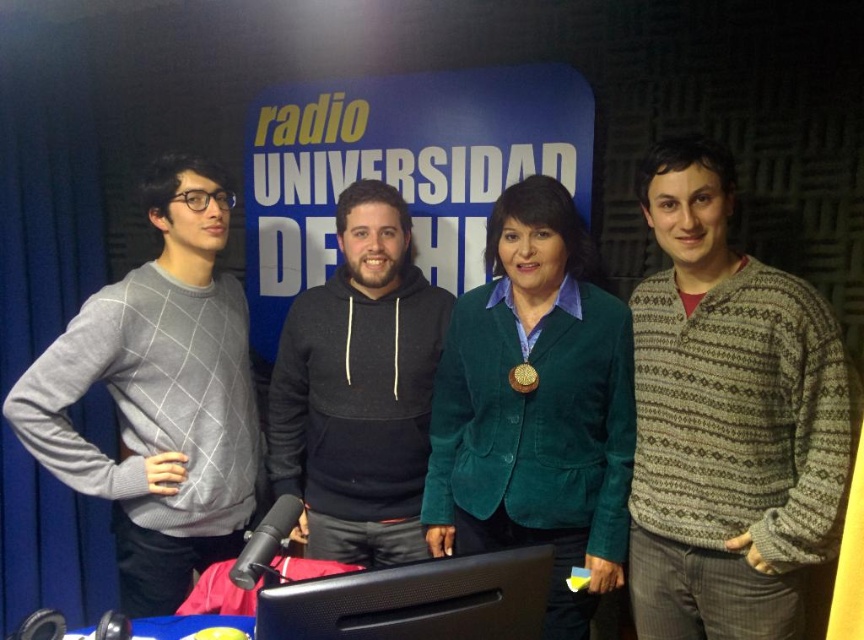
Question: Considering the relative positions of green corduroy blazer at center and gray wool sweater at left in the image provided, where is green corduroy blazer at center located with respect to gray wool sweater at left?

Choices:
 (A) below
 (B) above

Answer: (A)

Question: Does gray wool sweater at left have a lesser width compared to dark gray hoodie at center?

Choices:
 (A) no
 (B) yes

Answer: (B)

Question: Which point is farther to the camera?

Choices:
 (A) (54, 356)
 (B) (537, 380)
 (C) (704, 440)

Answer: (A)

Question: Observing the image, what is the correct spatial positioning of gray wool sweater at left in reference to gold shiny medal at center?

Choices:
 (A) left
 (B) right

Answer: (A)

Question: Which point appears farthest from the camera in this image?

Choices:
 (A) (202, 269)
 (B) (416, 525)
 (C) (513, 388)
 (D) (469, 467)

Answer: (B)

Question: Which point is farther from the camera taking this photo?

Choices:
 (A) (475, 496)
 (B) (697, 337)
 (C) (153, 604)

Answer: (C)